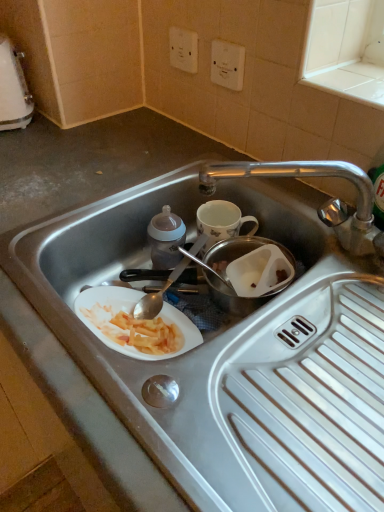
Question: Is white plastic kettle at upper left oriented towards stainless steel sink at center?

Choices:
 (A) no
 (B) yes

Answer: (A)

Question: Can you confirm if white plastic kettle at upper left is thinner than stainless steel sink at center?

Choices:
 (A) no
 (B) yes

Answer: (B)

Question: Is white plastic kettle at upper left smaller than stainless steel sink at center?

Choices:
 (A) no
 (B) yes

Answer: (B)

Question: From a real-world perspective, is white plastic kettle at upper left under stainless steel sink at center?

Choices:
 (A) no
 (B) yes

Answer: (A)

Question: Is white plastic kettle at upper left looking in the opposite direction of stainless steel sink at center?

Choices:
 (A) no
 (B) yes

Answer: (A)

Question: Considering the relative sizes of white plastic kettle at upper left and stainless steel sink at center in the image provided, is white plastic kettle at upper left bigger than stainless steel sink at center?

Choices:
 (A) yes
 (B) no

Answer: (B)

Question: From a real-world perspective, is white plastic electric outlet at upper center, positioned as the first electric outlet in right-to-left order, located higher than stainless steel sink at center?

Choices:
 (A) yes
 (B) no

Answer: (A)

Question: Is white plastic electric outlet at upper center, positioned as the first electric outlet in right-to-left order, located outside stainless steel sink at center?

Choices:
 (A) no
 (B) yes

Answer: (B)

Question: Are white plastic electric outlet at upper center, positioned as the first electric outlet in right-to-left order, and stainless steel sink at center far apart?

Choices:
 (A) yes
 (B) no

Answer: (B)

Question: Can you confirm if white plastic electric outlet at upper center, positioned as the first electric outlet in right-to-left order, is smaller than stainless steel sink at center?

Choices:
 (A) no
 (B) yes

Answer: (B)

Question: From the image's perspective, would you say white plastic electric outlet at upper center, the 2th electric outlet in the left-to-right sequence, is shown under stainless steel sink at center?

Choices:
 (A) yes
 (B) no

Answer: (B)

Question: Considering the relative positions of white plastic electric outlet at upper center, the 2th electric outlet in the left-to-right sequence, and stainless steel sink at center in the image provided, is white plastic electric outlet at upper center, the 2th electric outlet in the left-to-right sequence, in front of stainless steel sink at center?

Choices:
 (A) no
 (B) yes

Answer: (A)

Question: Considering the relative positions of white plastic electric outlet at upper center, arranged as the second electric outlet when viewed from the right, and transparent plastic container at center in the image provided, is white plastic electric outlet at upper center, arranged as the second electric outlet when viewed from the right, in front of transparent plastic container at center?

Choices:
 (A) no
 (B) yes

Answer: (A)